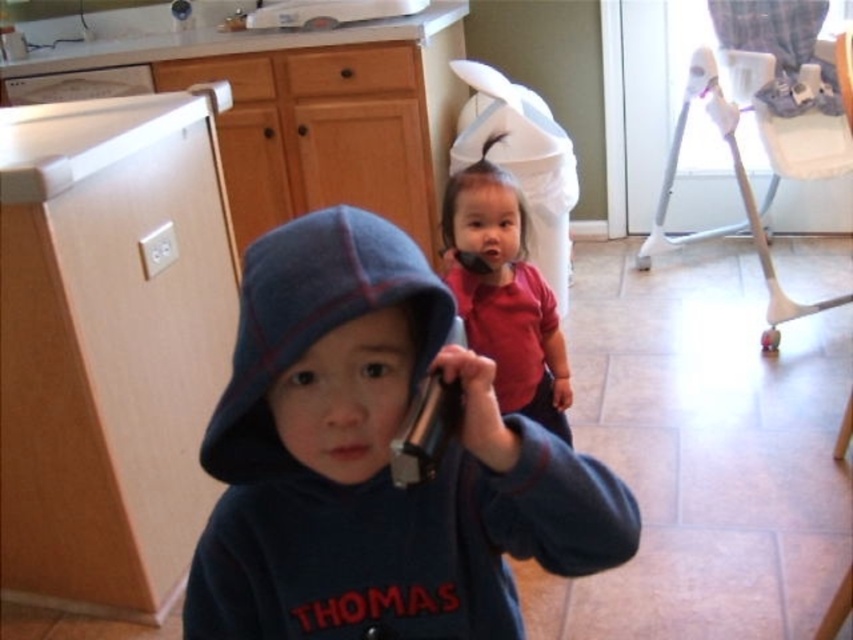
You are a photographer trying to capture both the dark blue fleece hoodie at center and the red matte shirt at center in a single shot. Since the camera can only focus on one subject at a time, which one will naturally be in focus if you focus on the foreground?

The dark blue fleece hoodie at center will be in focus because it is closer to the camera than the red matte shirt at center, which is behind it.

What is located at the coordinates point (x=375, y=460)?

The dark blue fleece hoodie at center is located at point (x=375, y=460).